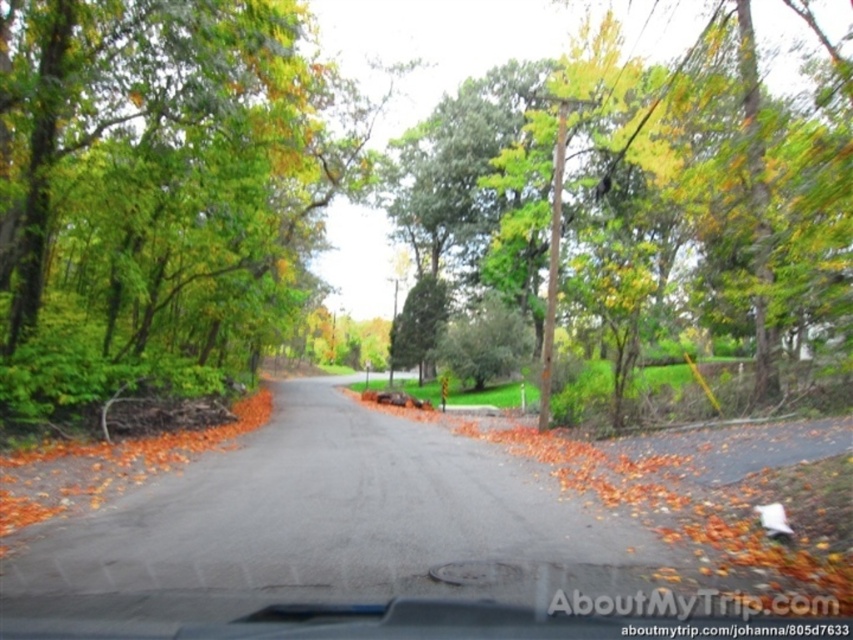
You are standing at the start of the road and want to take a photo of the green leafy tree at center. If your camera has a maximum focus distance of 20 feet, will you be able to capture the tree clearly?

The green leafy tree at center is 20.47 feet from the camera, which exceeds the maximum focus distance of 20 feet. Therefore, the tree will be out of focus and not captured clearly.